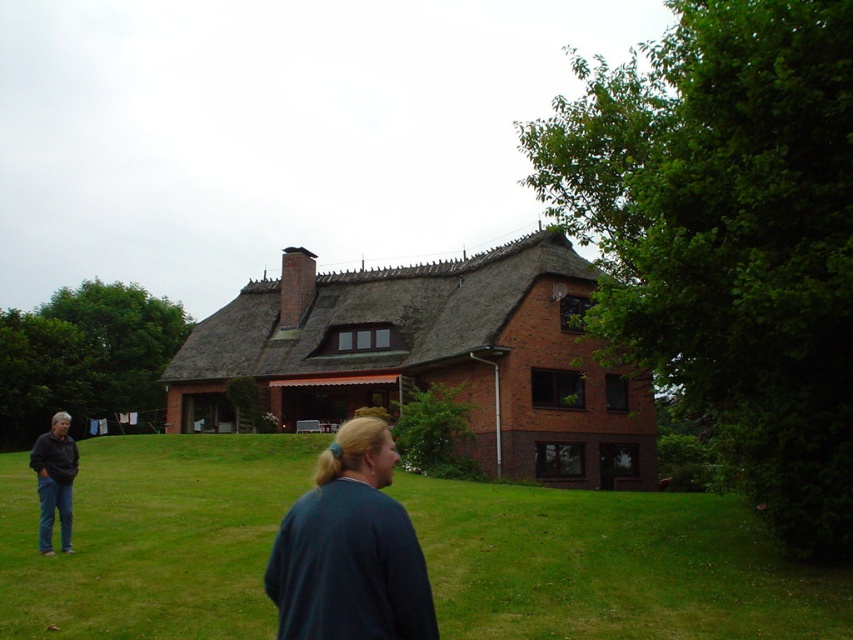
Question: Which point is farther to the camera?

Choices:
 (A) (312, 628)
 (B) (178, 456)

Answer: (B)

Question: Is green grass at lower left to the left of dark blue sweater at center from the viewer's perspective?

Choices:
 (A) no
 (B) yes

Answer: (B)

Question: Is green grass at lower left to the left of dark blue sweater at center from the viewer's perspective?

Choices:
 (A) no
 (B) yes

Answer: (B)

Question: Can you confirm if green grass at lower left is positioned below dark blue sweater at center?

Choices:
 (A) yes
 (B) no

Answer: (A)

Question: Which of the following is the farthest from the observer?

Choices:
 (A) (328, 570)
 (B) (107, 492)

Answer: (B)